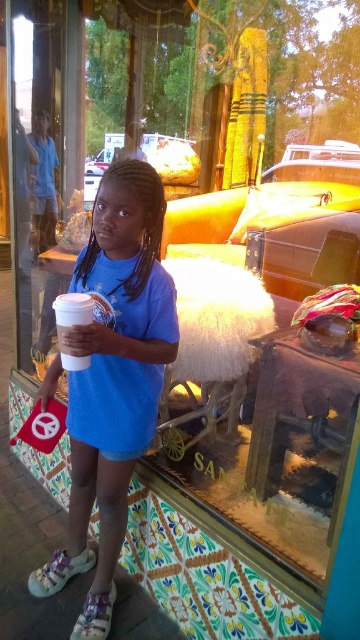
Question: Does blue matte shirt at center lie behind white paper cup at center?

Choices:
 (A) no
 (B) yes

Answer: (B)

Question: Observing the image, what is the correct spatial positioning of blue matte shirt at center in reference to white paper cup at center?

Choices:
 (A) below
 (B) above

Answer: (A)

Question: Which point is farther to the camera?

Choices:
 (A) white paper cup at center
 (B) blue matte shirt at center

Answer: (B)

Question: Does blue matte shirt at center lie behind white paper cup at center?

Choices:
 (A) no
 (B) yes

Answer: (B)